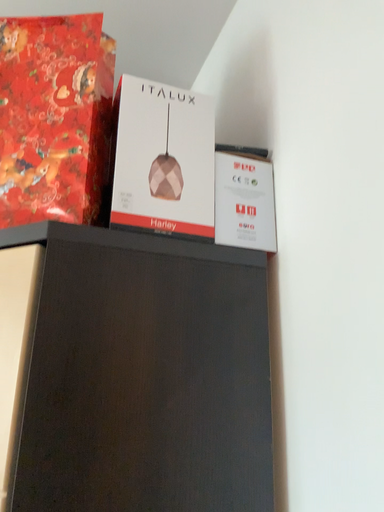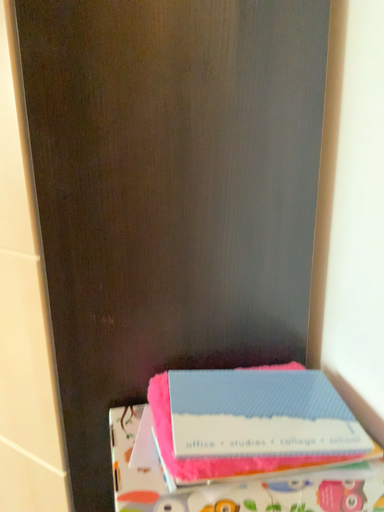
Question: Which way did the camera rotate in the video?

Choices:
 (A) rotated downward
 (B) rotated upward

Answer: (A)